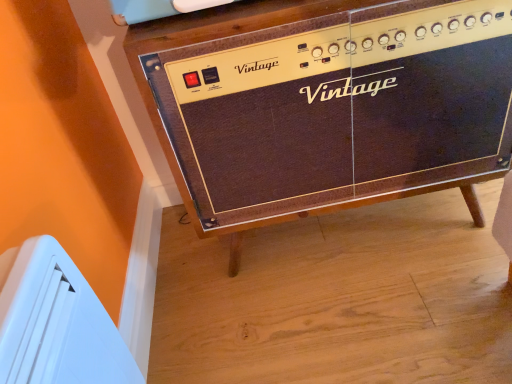
What do you see at coordinates (326, 104) in the screenshot? This screenshot has width=512, height=384. I see `brown fabric amplifier at center` at bounding box center [326, 104].

Locate an element on the screen. brown fabric amplifier at center is located at coordinates (326, 104).

The height and width of the screenshot is (384, 512). Identify the location of brown fabric amplifier at center. (326, 104).